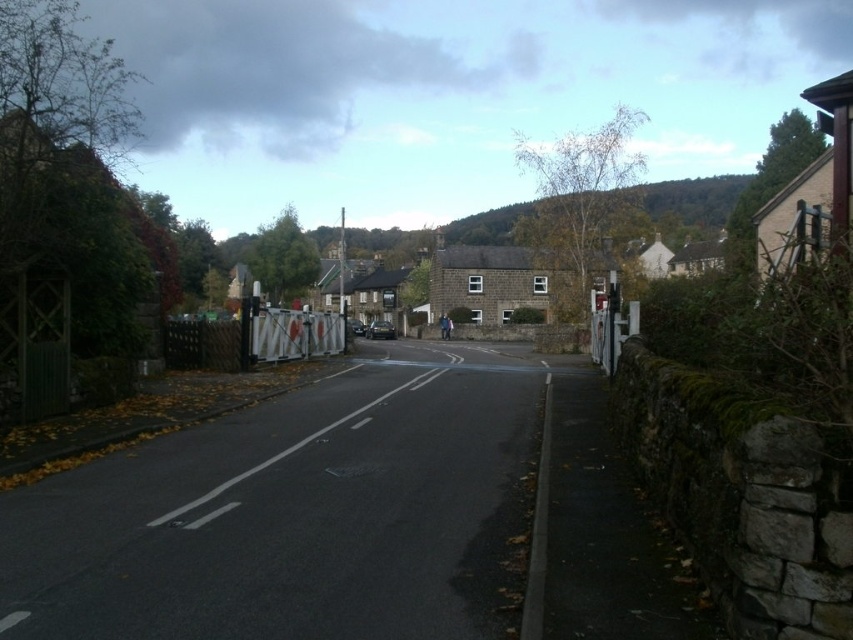
Can you confirm if brown stone house at center is taller than white plastic barrier at center?

Indeed, brown stone house at center has a greater height compared to white plastic barrier at center.

I want to click on brown stone house at center, so click(485, 282).

Which is behind, point (503, 272) or point (842, 99)?

The point (503, 272) is behind.

Does brown stone house at center have a greater width compared to stone house at center?

Incorrect, brown stone house at center's width does not surpass stone house at center's.

Locate an element on the screen. The width and height of the screenshot is (853, 640). brown stone house at center is located at coordinates (485, 282).

Can you confirm if white plastic barrier at center is shorter than stone house at center?

Indeed, white plastic barrier at center has a lesser height compared to stone house at center.

Between point (230, 369) and point (845, 182), which one is positioned in front?

Point (845, 182) is in front.

Between point (202, 333) and point (808, 188), which one is positioned behind?

Positioned behind is point (808, 188).

Image resolution: width=853 pixels, height=640 pixels. In order to click on white plastic barrier at center in this screenshot , I will do `click(251, 339)`.